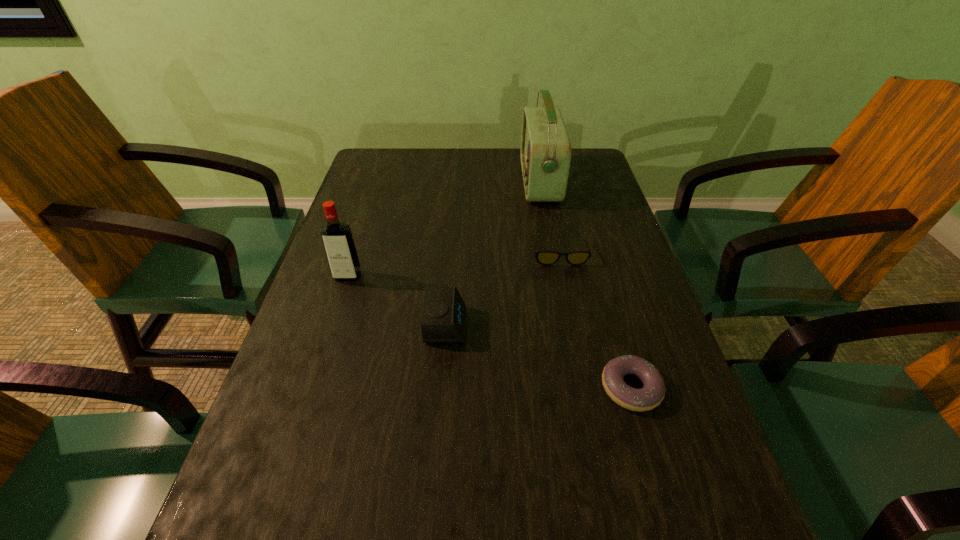
Identify the location of free spot located 0.060m on the front panel of the radio receiver. Image resolution: width=960 pixels, height=540 pixels. (501, 182).

Where is `vacant space situated on the front and back of the leftmost object`? The width and height of the screenshot is (960, 540). vacant space situated on the front and back of the leftmost object is located at coordinates click(x=331, y=330).

The image size is (960, 540). Find the location of `vacant space located 0.180m on the front-facing side of the fourth farthest object`. vacant space located 0.180m on the front-facing side of the fourth farthest object is located at coordinates (553, 325).

This screenshot has width=960, height=540. I want to click on free region located on the front-facing side of the sunglasses, so click(x=574, y=326).

What are the coordinates of `vacant space situated 0.370m on the back of the doughnut` in the screenshot? It's located at 589,242.

This screenshot has height=540, width=960. In order to click on object that is at the far edge in this screenshot , I will do `click(545, 154)`.

This screenshot has height=540, width=960. What are the coordinates of `object that is at the left edge` in the screenshot? It's located at pos(339,245).

The image size is (960, 540). I want to click on radio receiver positioned at the right edge, so click(x=545, y=154).

Where is `sunglasses positioned at the right edge`? This screenshot has height=540, width=960. sunglasses positioned at the right edge is located at coordinates (543, 257).

At what (x,y) coordinates should I click in order to perform the action: click on doughnut that is at the right edge. Please return your answer as a coordinate pair (x, y). This screenshot has width=960, height=540. Looking at the image, I should click on (651, 395).